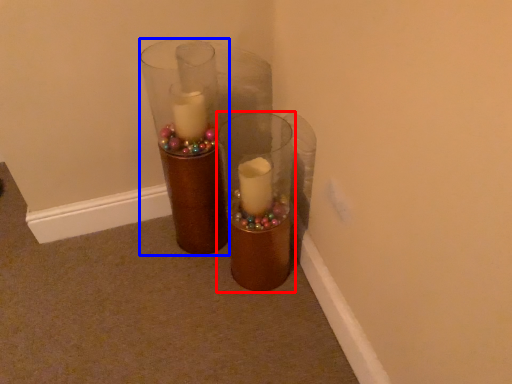
Question: Which object appears farthest to the camera in this image, vase (highlighted by a red box) or vase (highlighted by a blue box)?

Choices:
 (A) vase
 (B) vase

Answer: (B)